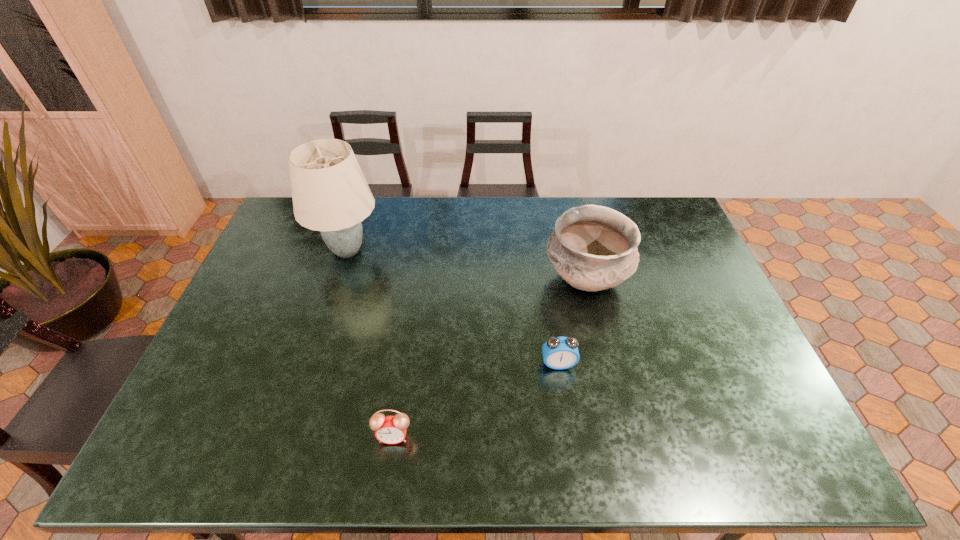
The height and width of the screenshot is (540, 960). In order to click on the tallest object in this screenshot , I will do `click(330, 194)`.

You are a GUI agent. You are given a task and a screenshot of the screen. Output one action in this format:
    pyautogui.click(x=<x>, y=<y>)
    Task: Click on the lampshade
    
    Given the screenshot: What is the action you would take?
    pyautogui.click(x=330, y=194)

This screenshot has width=960, height=540. What are the coordinates of `pottery` in the screenshot? It's located at (593, 248).

Where is `the second object from left to right`? This screenshot has height=540, width=960. the second object from left to right is located at coordinates (389, 429).

This screenshot has height=540, width=960. Identify the location of the nearest object. (389, 429).

Find the location of `the third farthest object`. the third farthest object is located at coordinates (559, 353).

Image resolution: width=960 pixels, height=540 pixels. I want to click on the farther alarm clock, so click(559, 353).

Locate an element on the screen. The height and width of the screenshot is (540, 960). vacant space situated on the front of the tallest object is located at coordinates coord(333,294).

This screenshot has height=540, width=960. I want to click on free region located 0.200m on the front of the pottery, so click(607, 370).

Where is `free space located on the face of the right alarm clock`? The width and height of the screenshot is (960, 540). free space located on the face of the right alarm clock is located at coordinates (567, 424).